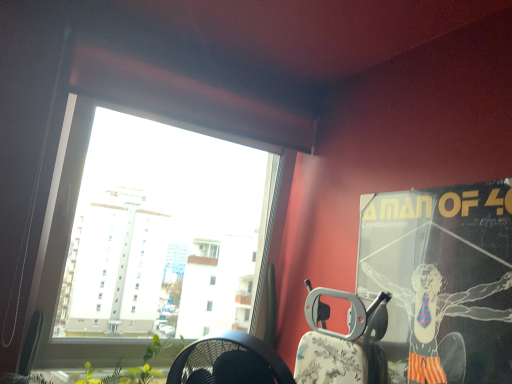
Question: From a real-world perspective, does metallic silver armchair at right stand above matte black poster at upper right?

Choices:
 (A) no
 (B) yes

Answer: (A)

Question: Is metallic silver armchair at right positioned before matte black poster at upper right?

Choices:
 (A) no
 (B) yes

Answer: (A)

Question: Is metallic silver armchair at right facing towards matte black poster at upper right?

Choices:
 (A) yes
 (B) no

Answer: (B)

Question: Is the depth of metallic silver armchair at right greater than that of matte black poster at upper right?

Choices:
 (A) yes
 (B) no

Answer: (A)

Question: Considering the relative sizes of metallic silver armchair at right and matte black poster at upper right in the image provided, is metallic silver armchair at right bigger than matte black poster at upper right?

Choices:
 (A) no
 (B) yes

Answer: (A)

Question: Considering the relative sizes of metallic silver armchair at right and matte black poster at upper right in the image provided, is metallic silver armchair at right wider than matte black poster at upper right?

Choices:
 (A) yes
 (B) no

Answer: (A)

Question: Is matte black poster at upper right to the left of metallic silver armchair at right from the viewer's perspective?

Choices:
 (A) no
 (B) yes

Answer: (A)

Question: From the image's perspective, is matte black poster at upper right under metallic silver armchair at right?

Choices:
 (A) no
 (B) yes

Answer: (A)

Question: Is matte black poster at upper right facing away from metallic silver armchair at right?

Choices:
 (A) no
 (B) yes

Answer: (A)

Question: Does matte black poster at upper right lie behind metallic silver armchair at right?

Choices:
 (A) yes
 (B) no

Answer: (B)

Question: Is matte black poster at upper right shorter than metallic silver armchair at right?

Choices:
 (A) yes
 (B) no

Answer: (B)

Question: From a real-world perspective, is matte black poster at upper right positioned under metallic silver armchair at right based on gravity?

Choices:
 (A) yes
 (B) no

Answer: (B)

Question: From a real-world perspective, is matte black poster at upper right physically located above or below metallic silver armchair at right?

Choices:
 (A) above
 (B) below

Answer: (A)